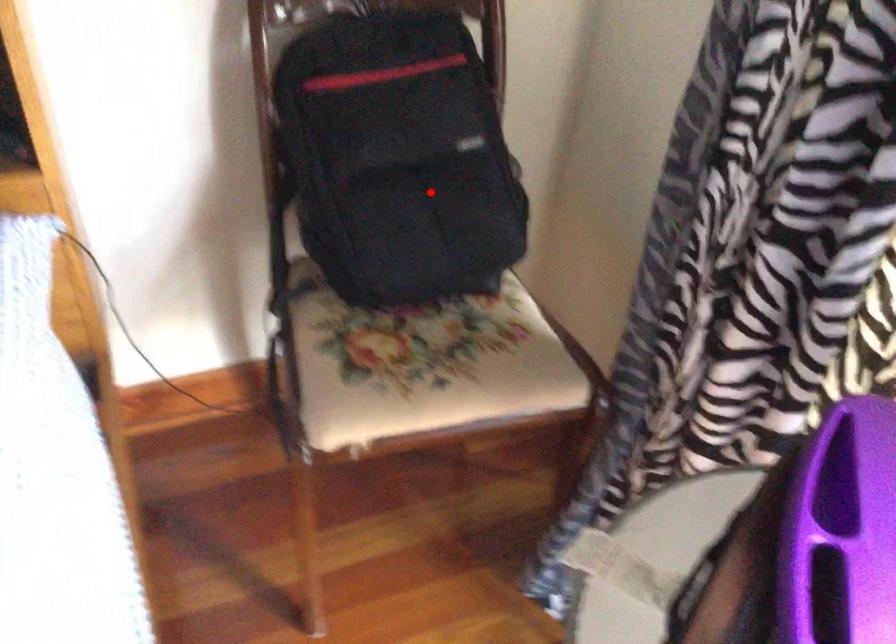
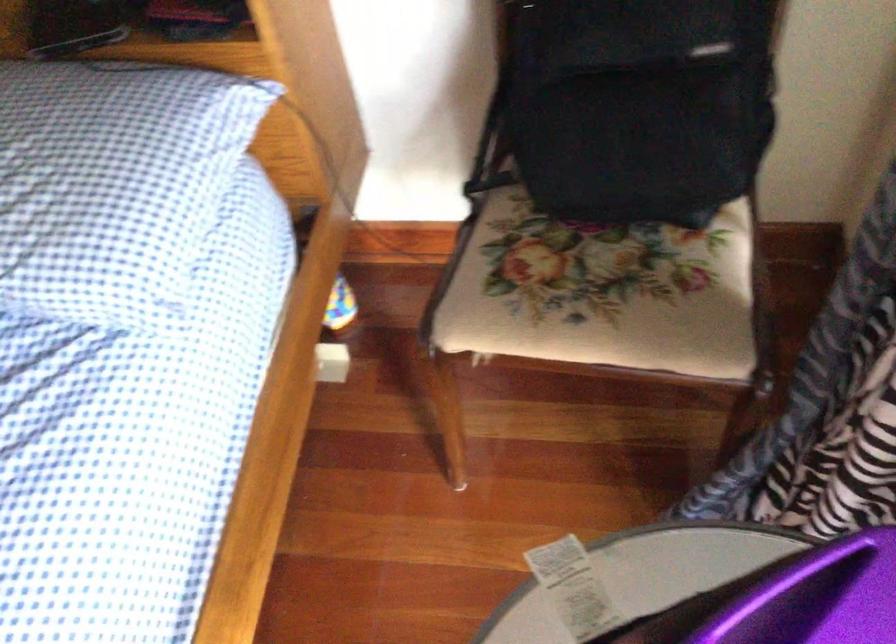
Question: I am providing you with two images of the same scene from different viewpoints. Image1 has a red point marked. In image2, the corresponding 3D location appears at what relative position? Reply with the corresponding letter.

Choices:
 (A) Closer
 (B) Farther

Answer: (A)